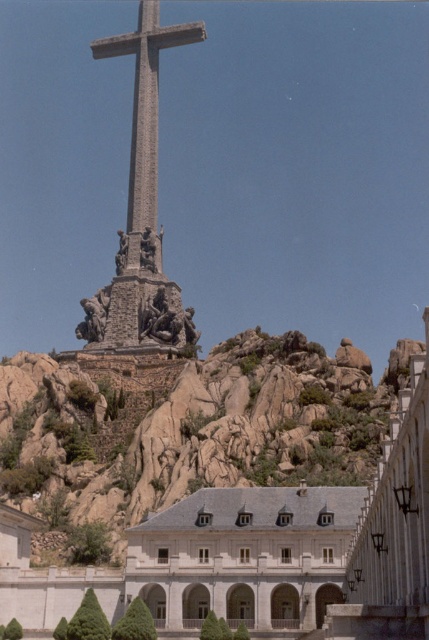
Question: From the image, what is the correct spatial relationship of white stone building at lower left in relation to stone cross at center?

Choices:
 (A) below
 (B) above

Answer: (A)

Question: From the image, what is the correct spatial relationship of white stone building at lower left in relation to stone cross at center?

Choices:
 (A) left
 (B) right

Answer: (B)

Question: Is white stone building at lower left thinner than stone cross at center?

Choices:
 (A) yes
 (B) no

Answer: (B)